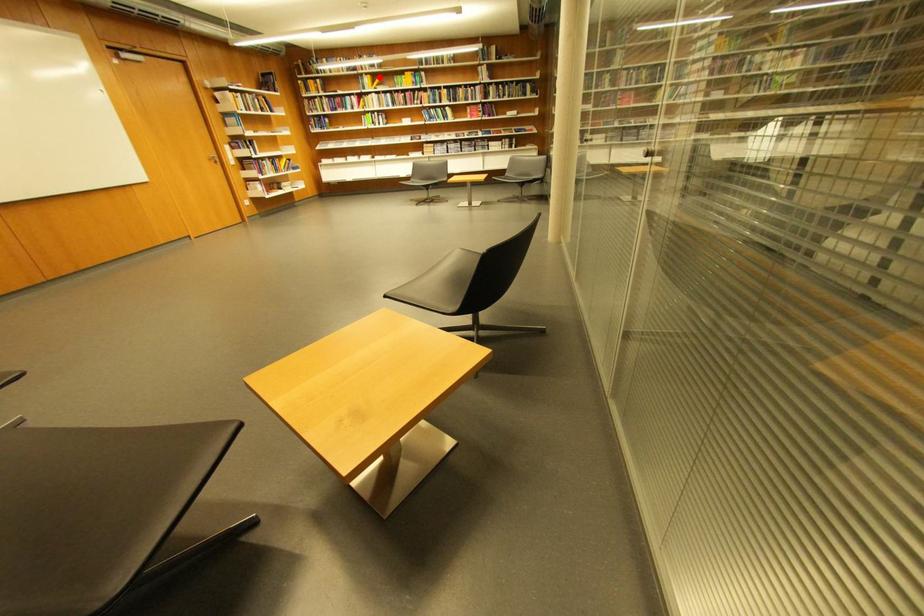
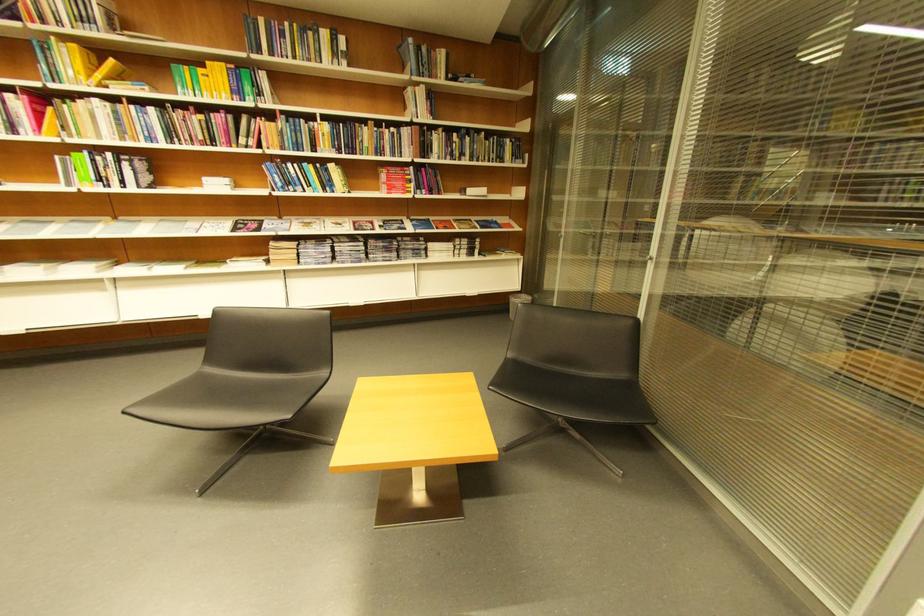
Question: I am providing you with two images of the same scene from different viewpoints. A red point is shown in image1. For the corresponding object point in image2, is it positioned nearer or farther from the camera?

Choices:
 (A) Nearer
 (B) Farther

Answer: (B)